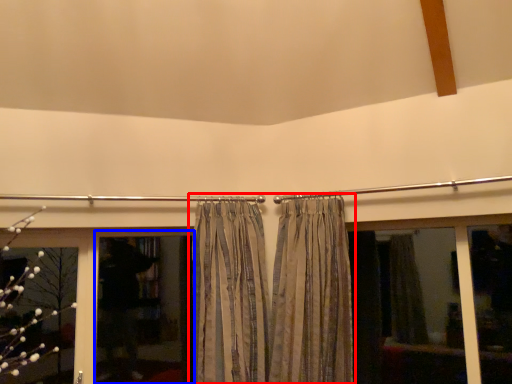
Question: Among these objects, which one is nearest to the camera, curtain (highlighted by a red box) or screen door (highlighted by a blue box)?

Choices:
 (A) curtain
 (B) screen door

Answer: (A)